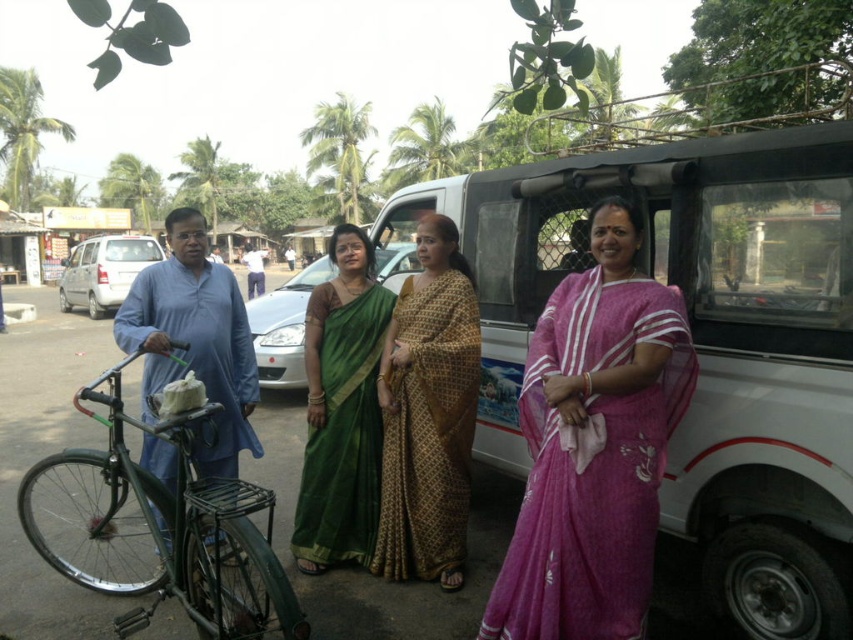
You are standing in the tropical street scene and want to move from the green bicycle to the parked vehicle. Which direction should you walk to reach the parked vehicle without passing through the two points marked as point (x=503, y=348) and point (x=647, y=467)?

To reach the parked vehicle without passing through the two points, you should walk around the area closer to the viewer since point (x=503, y=348) is closer to you than point (x=647, y=467).

Based on the photo, you are a photographer trying to capture a clear shot of the two women in the center wearing the pink silk saree at center and the gold printed saree at center. Since you want both in focus, which saree should you focus on first to ensure the other is also in the frame?

You should focus on the pink silk saree at center first because it is closer to the viewer than the gold printed saree at center, so adjusting focus from closer to farther will help both appear sharp.

You are a photographer trying to capture the white plastic bus at center and the pink silk saree at center in the same frame. Based on their positions, will the bus block the view of the saree in the photo?

The white plastic bus at center is in front of the pink silk saree at center, so the bus will block the view of the saree in the photo.